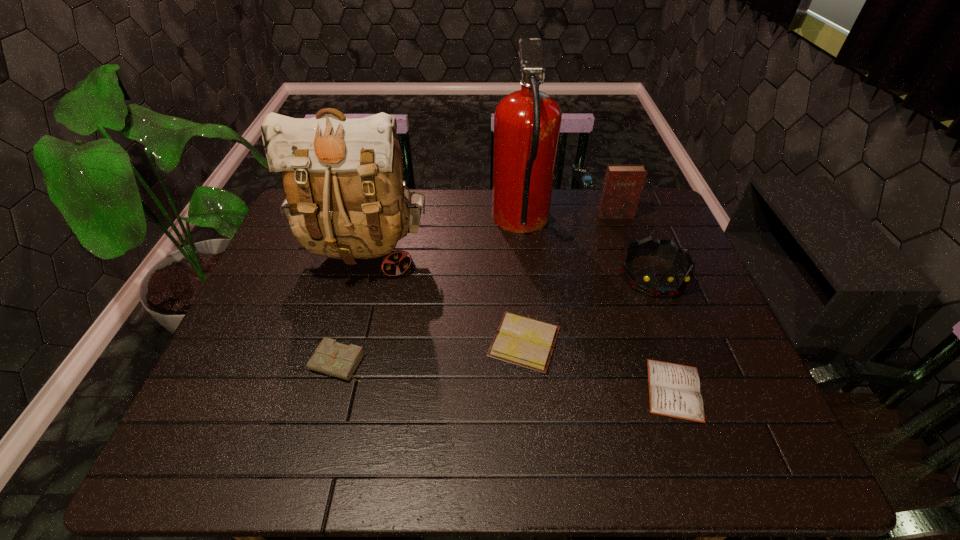
Image resolution: width=960 pixels, height=540 pixels. In order to click on backpack that is at the far edge in this screenshot , I will do `click(342, 178)`.

At what (x,y) coordinates should I click in order to perform the action: click on diary that is at the far edge. Please return your answer as a coordinate pair (x, y). This screenshot has height=540, width=960. Looking at the image, I should click on (623, 184).

Find the location of a particular element. The image size is (960, 540). object that is at the left edge is located at coordinates (342, 178).

In order to click on tiara that is at the right edge in this screenshot , I will do `click(668, 286)`.

Image resolution: width=960 pixels, height=540 pixels. Find the location of `object situated at the far left corner`. object situated at the far left corner is located at coordinates (342, 178).

Locate an element on the screen. object located in the far right corner section of the desktop is located at coordinates (623, 184).

Where is `free region at the far edge of the desktop`? This screenshot has height=540, width=960. free region at the far edge of the desktop is located at coordinates 477,202.

At what (x,y) coordinates should I click in order to perform the action: click on free space at the left edge of the desktop. Please return your answer as a coordinate pair (x, y). This screenshot has width=960, height=540. Looking at the image, I should click on (319, 283).

Identify the location of vacant space at the right edge. (645, 263).

Where is `free space between the second tallest diary and the tiara`? The height and width of the screenshot is (540, 960). free space between the second tallest diary and the tiara is located at coordinates (496, 319).